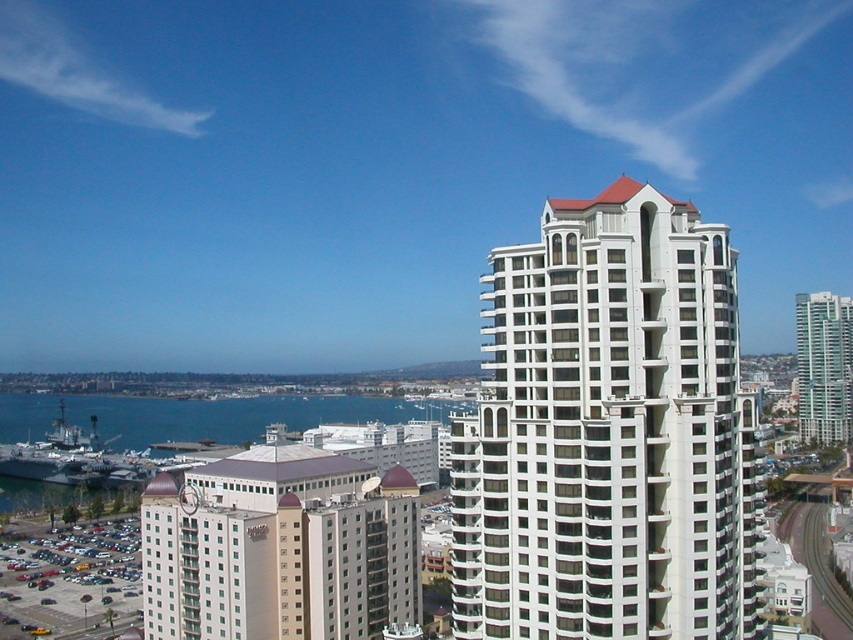
Question: Which point is farther to the camera?

Choices:
 (A) pos(177,433)
 (B) pos(379,588)
 (C) pos(851,400)
 (D) pos(534,262)

Answer: (A)

Question: Which object appears farthest from the camera in this image?

Choices:
 (A) blue water at lower left
 (B) beige/marble hotel at center

Answer: (A)

Question: From the image, what is the correct spatial relationship of beige/marble hotel at center in relation to smooth glass skyscraper at right?

Choices:
 (A) above
 (B) below

Answer: (B)

Question: Can you confirm if beige/marble hotel at center is bigger than smooth glass skyscraper at right?

Choices:
 (A) no
 (B) yes

Answer: (A)

Question: Which object is the farthest from the white glass building at center?

Choices:
 (A) smooth glass skyscraper at right
 (B) blue water at lower left
 (C) beige/marble hotel at center

Answer: (B)

Question: In this image, where is beige/marble hotel at center located relative to blue water at lower left?

Choices:
 (A) right
 (B) left

Answer: (A)